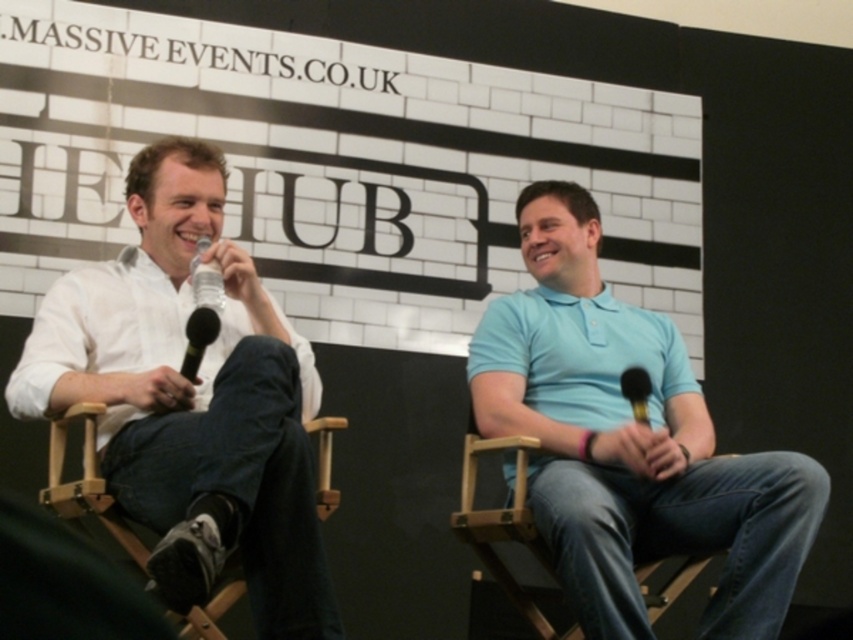
Who is lower down, light blue cotton polo shirt at right or wooden chair at center?

wooden chair at center is lower down.

Between light blue cotton polo shirt at right and wooden chair at center, which one has less height?

With less height is light blue cotton polo shirt at right.

Between point (548, 403) and point (497, 536), which one is positioned behind?

Positioned behind is point (548, 403).

Locate an element on the screen. This screenshot has height=640, width=853. light blue cotton polo shirt at right is located at coordinates (579, 355).

Which is above, white matte shirt at left or white matte polo shirt at left?

white matte polo shirt at left is higher up.

Between point (165, 600) and point (9, 412), which one is positioned in front?

Positioned in front is point (165, 600).

The width and height of the screenshot is (853, 640). Identify the location of white matte shirt at left. (190, 401).

Does light blue polo shirt at center have a lesser width compared to wooden chair at lower left?

Incorrect, light blue polo shirt at center's width is not less than wooden chair at lower left's.

Is point (602, 412) positioned behind point (109, 522)?

That is True.

What do you see at coordinates (630, 442) in the screenshot? Image resolution: width=853 pixels, height=640 pixels. I see `light blue polo shirt at center` at bounding box center [630, 442].

Image resolution: width=853 pixels, height=640 pixels. I want to click on light blue polo shirt at center, so click(630, 442).